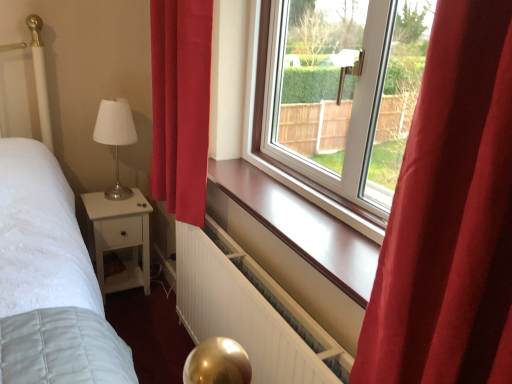
This screenshot has height=384, width=512. I want to click on blank space situated above white matte nightstand at lower left (from a real-world perspective), so click(108, 200).